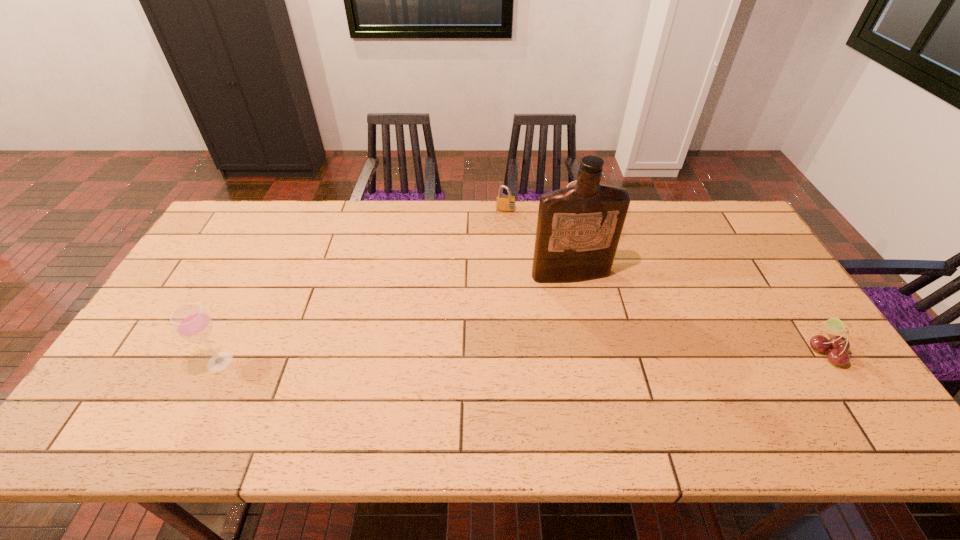
What are the coordinates of `wineglass` in the screenshot? It's located at (191, 321).

Locate an element on the screen. This screenshot has height=540, width=960. the leftmost object is located at coordinates (191, 321).

Find the location of a particular element. The image size is (960, 540). cherry is located at coordinates (838, 345).

Locate an element on the screen. This screenshot has height=540, width=960. padlock is located at coordinates (506, 203).

You are a GUI agent. You are given a task and a screenshot of the screen. Output one action in this format:
    pyautogui.click(x=<x>, y=<y>)
    Task: Click on the tallest object
    This screenshot has height=540, width=960.
    Given the screenshot: What is the action you would take?
    pyautogui.click(x=578, y=230)

Locate an element on the screen. liquor is located at coordinates (578, 230).

The image size is (960, 540). What are the coordinates of `mug` in the screenshot? It's located at (572, 183).

Find the location of `vacant point located on the back of the wineglass`. vacant point located on the back of the wineglass is located at coordinates (236, 329).

You are a GUI agent. You are given a task and a screenshot of the screen. Output one action in this format:
    pyautogui.click(x=<x>, y=<y>)
    Task: Click on the vacant space located on the leaves of the cherry
    The image size is (960, 540).
    Given the screenshot: What is the action you would take?
    pyautogui.click(x=678, y=351)

Locate an element on the screen. The height and width of the screenshot is (540, 960). vacant space located 0.070m on the leaves of the cherry is located at coordinates (781, 351).